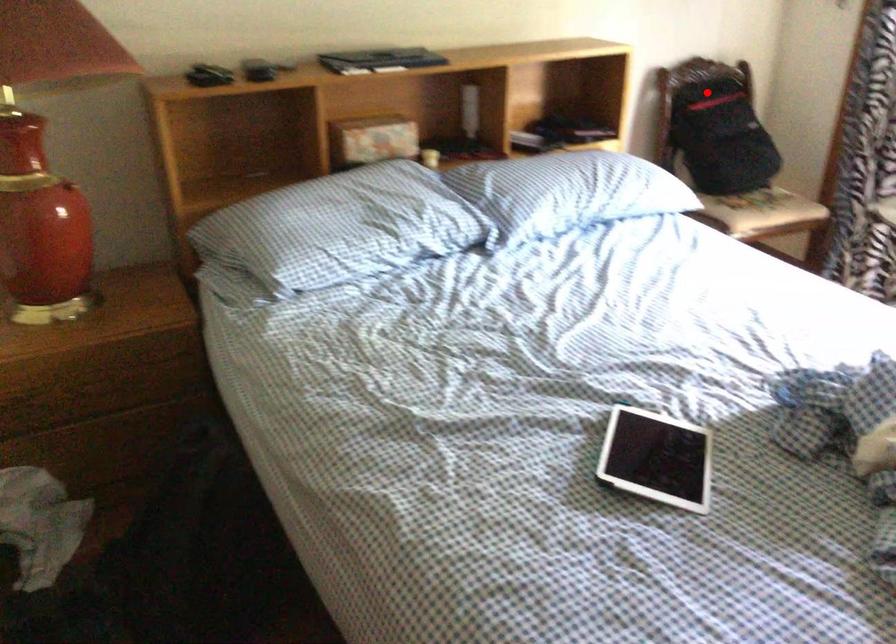
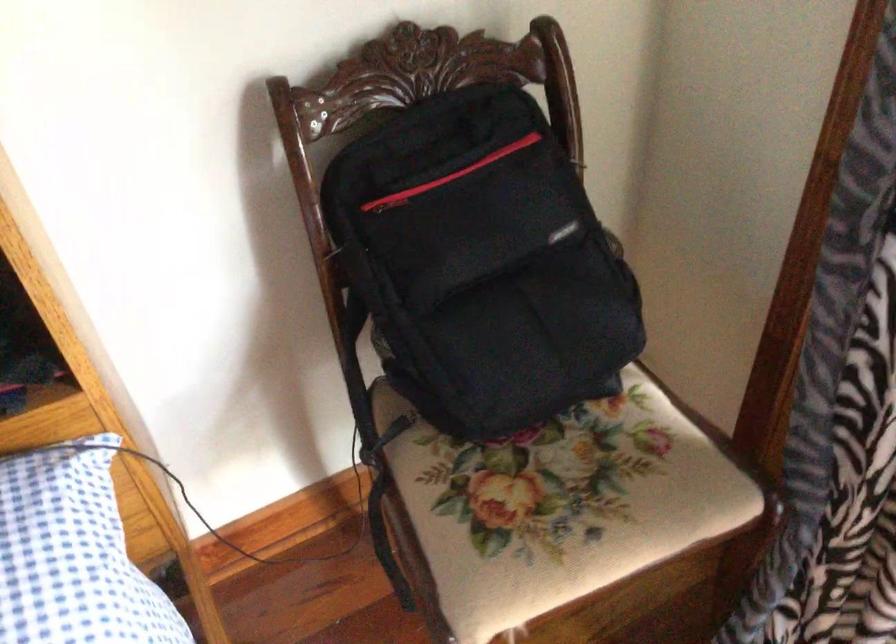
Question: I am providing you with two images of the same scene from different viewpoints. In image1, a red point is highlighted. Considering the same 3D point in image2, which of the following is correct?

Choices:
 (A) It is closer
 (B) It is farther

Answer: (A)